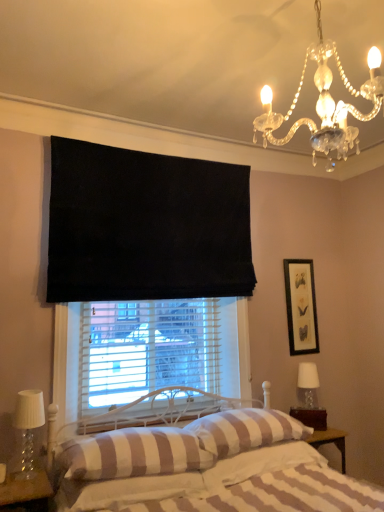
Locate an element on the screen. striped fabric pillow at center, arranged as the 1th pillow when viewed from the right is located at coordinates (260, 463).

Measure the distance between striped fabric pillow at center, which is the 3th pillow in left-to-right order, and camera.

A: striped fabric pillow at center, which is the 3th pillow in left-to-right order, and camera are 2.02 meters apart from each other.

You are a GUI agent. You are given a task and a screenshot of the screen. Output one action in this format:
    pyautogui.click(x=<x>, y=<y>)
    Task: Click on the clear glass table lamp at lower left, positioned as the second table lamp in right-to-left order
    This screenshot has width=384, height=512.
    Given the screenshot: What is the action you would take?
    pyautogui.click(x=28, y=426)

Find the location of a particular element. This screenshot has height=512, width=384. brown wooden nightstand at lower right is located at coordinates (310, 417).

Consider the image. What is the approximate width of striped fabric pillow at center, which appears as the 2th pillow when viewed from the left?

striped fabric pillow at center, which appears as the 2th pillow when viewed from the left, is 16.59 inches in width.

What is the approximate width of white striped fabric bed at center?

white striped fabric bed at center is 6.01 feet in width.

Image resolution: width=384 pixels, height=512 pixels. What do you see at coordinates (301, 306) in the screenshot?
I see `black matte picture frame at upper right` at bounding box center [301, 306].

At what (x,y) coordinates should I click in order to perform the action: click on striped fabric pillow at center, which is the 3th pillow in left-to-right order. Please return your answer as a coordinate pair (x, y). This screenshot has width=384, height=512. Looking at the image, I should click on [x=260, y=463].

Is striped cotton sheet at lower center beside striped fabric pillow at lower center, which is the 3th pillow in right-to-left order?

Yes.

In terms of size, does striped cotton sheet at lower center appear bigger or smaller than striped fabric pillow at lower center, acting as the first pillow starting from the left?

Considering their sizes, striped cotton sheet at lower center takes up less space than striped fabric pillow at lower center, acting as the first pillow starting from the left.

Could you tell me if striped cotton sheet at lower center is facing striped fabric pillow at lower center, which is the 3th pillow in right-to-left order?

No, striped cotton sheet at lower center is not aimed at striped fabric pillow at lower center, which is the 3th pillow in right-to-left order.

How different are the orientations of striped cotton sheet at lower center and striped fabric pillow at lower center, acting as the first pillow starting from the left, in degrees?

The angle between the facing direction of striped cotton sheet at lower center and the facing direction of striped fabric pillow at lower center, acting as the first pillow starting from the left, is 0.000477 degrees.

Does clear glass table lamp at lower left, acting as the second table lamp starting from the back, appear on the left side of striped fabric pillow at center, arranged as the 1th pillow when viewed from the right?

Correct, you'll find clear glass table lamp at lower left, acting as the second table lamp starting from the back, to the left of striped fabric pillow at center, arranged as the 1th pillow when viewed from the right.

From a real-world perspective, who is located higher, clear glass table lamp at lower left, acting as the 1th table lamp starting from the left, or striped fabric pillow at center, which is the 3th pillow in left-to-right order?

clear glass table lamp at lower left, acting as the 1th table lamp starting from the left.

Does point (39, 424) come in front of point (263, 451)?

Yes, it is.

Is clear glass table lamp at lower left, the 1th table lamp when ordered from front to back, bigger than striped fabric pillow at center, which is the 3th pillow in left-to-right order?

No.

From a real-world perspective, which object rests below the other?

striped cotton sheet at lower center.

Measure the distance between striped cotton sheet at lower center and clear crystal chandelier at upper right.

striped cotton sheet at lower center and clear crystal chandelier at upper right are 1.75 meters apart from each other.

Considering the relative positions of striped cotton sheet at lower center and clear crystal chandelier at upper right in the image provided, is striped cotton sheet at lower center to the right of clear crystal chandelier at upper right from the viewer's perspective?

In fact, striped cotton sheet at lower center is to the left of clear crystal chandelier at upper right.

Which is behind, brown wooden nightstand at lower right or striped cotton sheet at lower center?

brown wooden nightstand at lower right is further away from the camera.

From their relative heights in the image, would you say brown wooden nightstand at lower right is taller or shorter than striped cotton sheet at lower center?

brown wooden nightstand at lower right is taller than striped cotton sheet at lower center.

Is point (312, 414) closer or farther from the camera than point (190, 487)?

Clearly, point (312, 414) is more distant from the camera than point (190, 487).

How many degrees apart are the facing directions of brown wooden nightstand at lower right and striped cotton sheet at lower center?

The angle between the facing direction of brown wooden nightstand at lower right and the facing direction of striped cotton sheet at lower center is 35 degrees.

Does white striped fabric bed at center have a smaller size compared to clear glass table lamp at right, the first table lamp from the back?

Incorrect, white striped fabric bed at center is not smaller in size than clear glass table lamp at right, the first table lamp from the back.

Does white striped fabric bed at center have a greater height compared to clear glass table lamp at right, the first table lamp from the back?

Yes.

At what (x,y) coordinates should I click in order to perform the action: click on bed located below the clear glass table lamp at right, the first table lamp from the back (from the image's perspective). Please return your answer as a coordinate pair (x, y). Image resolution: width=384 pixels, height=512 pixels. Looking at the image, I should click on (208, 468).

Considering the relative sizes of clear glass table lamp at right, which appears as the second table lamp when viewed from the left, and clear glass table lamp at lower left, positioned as the second table lamp in right-to-left order, in the image provided, is clear glass table lamp at right, which appears as the second table lamp when viewed from the left, wider than clear glass table lamp at lower left, positioned as the second table lamp in right-to-left order,?

Correct, the width of clear glass table lamp at right, which appears as the second table lamp when viewed from the left, exceeds that of clear glass table lamp at lower left, positioned as the second table lamp in right-to-left order.

From a real-world perspective, who is located higher, clear glass table lamp at right, the 1th table lamp when ordered from right to left, or clear glass table lamp at lower left, acting as the second table lamp starting from the back?

In real-world perspective, clear glass table lamp at right, the 1th table lamp when ordered from right to left, is above.

Is point (308, 384) less distant than point (43, 407)?

No, (308, 384) is behind (43, 407).

Based on the photo, between clear glass table lamp at right, the first table lamp from the back, and clear glass table lamp at lower left, the 1th table lamp when ordered from front to back, which one has more height?

clear glass table lamp at lower left, the 1th table lamp when ordered from front to back.

Which object is positioned more to the right, striped fabric pillow at center, arranged as the 1th pillow when viewed from the right, or white striped fabric bed at center?

striped fabric pillow at center, arranged as the 1th pillow when viewed from the right.

Between striped fabric pillow at center, arranged as the 1th pillow when viewed from the right, and white striped fabric bed at center, which one has larger size?

With larger size is white striped fabric bed at center.

Is white striped fabric bed at center located within striped fabric pillow at center, arranged as the 1th pillow when viewed from the right?

No, white striped fabric bed at center is located outside of striped fabric pillow at center, arranged as the 1th pillow when viewed from the right.

Which of these two, striped fabric pillow at center, arranged as the 1th pillow when viewed from the right, or white striped fabric bed at center, is thinner?

With smaller width is striped fabric pillow at center, arranged as the 1th pillow when viewed from the right.

From a real-world perspective, count 2nd pillows upward from the striped cotton sheet at lower center and point to it. Please provide its 2D coordinates.

[(134, 454)]

You are a GUI agent. You are given a task and a screenshot of the screen. Output one action in this format:
    pyautogui.click(x=<x>, y=<y>)
    Task: Click on the table lamp that is the 2nd object located above the striped fabric pillow at center, which is the 3th pillow in left-to-right order (from the image's perspective)
    Image resolution: width=384 pixels, height=512 pixels.
    Given the screenshot: What is the action you would take?
    pyautogui.click(x=28, y=426)

Which object lies nearer to the anchor point striped fabric pillow at lower center, acting as the first pillow starting from the left, clear crystal chandelier at upper right or clear glass table lamp at lower left, the 1th table lamp when ordered from front to back?

Based on the image, clear glass table lamp at lower left, the 1th table lamp when ordered from front to back, appears to be nearer to striped fabric pillow at lower center, acting as the first pillow starting from the left.

Based on their spatial positions, is striped fabric pillow at center, arranged as the 1th pillow when viewed from the right, or white striped fabric bed at center further from clear glass table lamp at lower left, acting as the 1th table lamp starting from the left?

Among the two, striped fabric pillow at center, arranged as the 1th pillow when viewed from the right, is located further to clear glass table lamp at lower left, acting as the 1th table lamp starting from the left.

Estimate the real-world distances between objects in this image. Which object is further from striped cotton sheet at lower center, white striped fabric bed at center or clear glass table lamp at right, the 1th table lamp when ordered from right to left?

clear glass table lamp at right, the 1th table lamp when ordered from right to left, is further to striped cotton sheet at lower center.

From the picture: From the image, which object appears to be nearer to white striped fabric bed at center, striped fabric pillow at center, the 2th pillow positioned from the right, or striped fabric pillow at center, arranged as the 1th pillow when viewed from the right?

The object closer to white striped fabric bed at center is striped fabric pillow at center, the 2th pillow positioned from the right.

When comparing their distances from clear glass table lamp at lower left, the 1th table lamp when ordered from front to back, does striped cotton sheet at lower center or striped fabric pillow at center, the 2th pillow positioned from the right, seem further?

striped fabric pillow at center, the 2th pillow positioned from the right, is positioned further to the anchor clear glass table lamp at lower left, the 1th table lamp when ordered from front to back.

Considering their positions, is black matte picture frame at upper right positioned further to clear glass table lamp at lower left, the 1th table lamp when ordered from front to back, than clear crystal chandelier at upper right?

black matte picture frame at upper right is positioned further to the anchor clear glass table lamp at lower left, the 1th table lamp when ordered from front to back.

Which object lies nearer to the anchor point striped fabric pillow at lower center, which is the 3th pillow in right-to-left order, striped fabric pillow at center, the 2th pillow positioned from the right, or striped cotton sheet at lower center?

striped cotton sheet at lower center is positioned closer to the anchor striped fabric pillow at lower center, which is the 3th pillow in right-to-left order.

Considering their positions, is black matte picture frame at upper right positioned closer to white striped fabric bed at center than striped fabric pillow at center, arranged as the 1th pillow when viewed from the right?

striped fabric pillow at center, arranged as the 1th pillow when viewed from the right, is closer to white striped fabric bed at center.

The height and width of the screenshot is (512, 384). In order to click on pillow positioned between white striped fabric bed at center and striped cotton sheet at lower center from near to far in this screenshot , I will do `click(134, 454)`.

The image size is (384, 512). Find the location of `furniture between clear crystal chandelier at upper right and striped fabric pillow at center, which is the 3th pillow in left-to-right order, from top to bottom`. furniture between clear crystal chandelier at upper right and striped fabric pillow at center, which is the 3th pillow in left-to-right order, from top to bottom is located at coordinates (310, 417).

Locate an element on the screen. furniture between striped fabric pillow at lower center, acting as the first pillow starting from the left, and clear glass table lamp at right, the 1th table lamp when ordered from right to left is located at coordinates (310, 417).

This screenshot has width=384, height=512. What are the coordinates of `sheet between clear glass table lamp at lower left, the 1th table lamp when ordered from front to back, and clear glass table lamp at right, which appears as the second table lamp when viewed from the left, from left to right` in the screenshot? It's located at (124, 490).